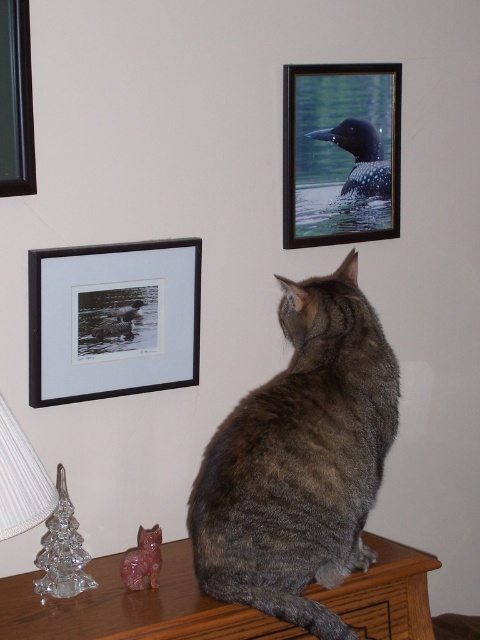
Question: Which point is farther to the camera?

Choices:
 (A) clear glass christmas tree at lower left
 (B) gray fur cat at center
 (C) wooden table at lower center
 (D) wooden frame at upper right

Answer: (D)

Question: Does wooden table at lower center have a smaller size compared to clear glass christmas tree at lower left?

Choices:
 (A) no
 (B) yes

Answer: (A)

Question: Based on their relative distances, which object is nearer to the wooden frame at upper right?

Choices:
 (A) black glass picture frame at upper left
 (B) black matte frame at upper left
 (C) wooden table at lower center

Answer: (B)

Question: Does wooden frame at upper right have a larger size compared to black glass picture frame at upper left?

Choices:
 (A) yes
 (B) no

Answer: (A)

Question: Is gray fur cat at center to the left of wooden table at lower center from the viewer's perspective?

Choices:
 (A) no
 (B) yes

Answer: (A)

Question: Considering the real-world distances, which object is closest to the wooden frame at upper right?

Choices:
 (A) wooden table at lower center
 (B) black glass picture frame at upper left
 (C) clear glass christmas tree at lower left
 (D) gray fur cat at center

Answer: (D)